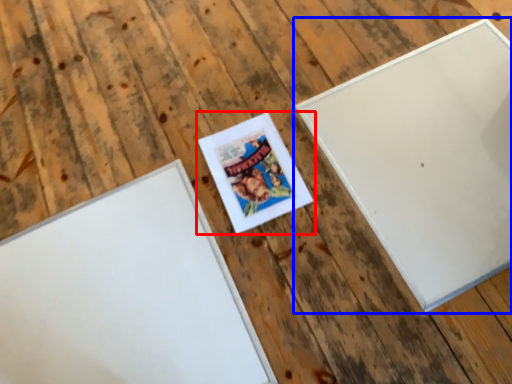
Question: Among these objects, which one is farthest to the camera, picture frame (highlighted by a red box) or picture frame (highlighted by a blue box)?

Choices:
 (A) picture frame
 (B) picture frame

Answer: (A)